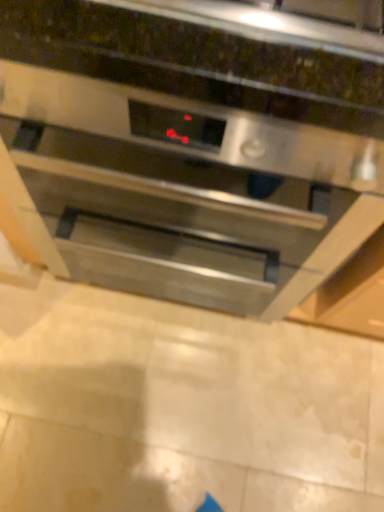
Identify the location of stainless steel oven at center. (192, 146).

This screenshot has height=512, width=384. Describe the element at coordinates (192, 146) in the screenshot. I see `stainless steel oven at center` at that location.

Find the location of a particular element. stainless steel oven at center is located at coordinates (192, 146).